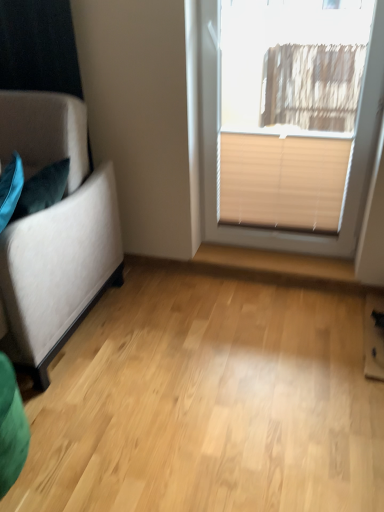
Question: Is beige blind at upper right not within light wood floor at center?

Choices:
 (A) yes
 (B) no

Answer: (A)

Question: Is beige blind at upper right facing towards light wood floor at center?

Choices:
 (A) no
 (B) yes

Answer: (B)

Question: Considering the relative sizes of beige blind at upper right and light wood floor at center in the image provided, is beige blind at upper right shorter than light wood floor at center?

Choices:
 (A) no
 (B) yes

Answer: (A)

Question: Is light wood floor at center surrounded by beige blind at upper right?

Choices:
 (A) no
 (B) yes

Answer: (A)

Question: Does beige blind at upper right come behind light wood floor at center?

Choices:
 (A) no
 (B) yes

Answer: (B)

Question: Does beige blind at upper right have a smaller size compared to light wood floor at center?

Choices:
 (A) no
 (B) yes

Answer: (B)

Question: Would you consider beige fabric blind at upper right to be distant from suede-like beige couch at left?

Choices:
 (A) no
 (B) yes

Answer: (A)

Question: Is beige fabric blind at upper right smaller than suede-like beige couch at left?

Choices:
 (A) yes
 (B) no

Answer: (A)

Question: Is beige fabric blind at upper right facing towards suede-like beige couch at left?

Choices:
 (A) no
 (B) yes

Answer: (A)

Question: From the image's perspective, is beige fabric blind at upper right located beneath suede-like beige couch at left?

Choices:
 (A) no
 (B) yes

Answer: (A)

Question: Is beige fabric blind at upper right wider than suede-like beige couch at left?

Choices:
 (A) no
 (B) yes

Answer: (A)

Question: Considering the relative sizes of beige fabric blind at upper right and suede-like beige couch at left in the image provided, is beige fabric blind at upper right bigger than suede-like beige couch at left?

Choices:
 (A) yes
 (B) no

Answer: (B)

Question: Is the depth of beige fabric blind at upper right greater than that of beige blind at upper right?

Choices:
 (A) yes
 (B) no

Answer: (A)